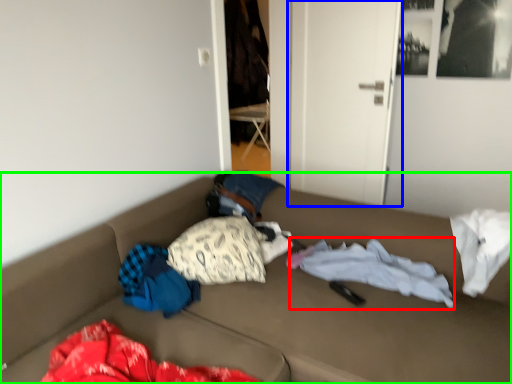
Question: Which object is positioned farthest from blanket (highlighted by a red box)? Select from door (highlighted by a blue box) and furniture (highlighted by a green box).

Choices:
 (A) door
 (B) furniture

Answer: (A)